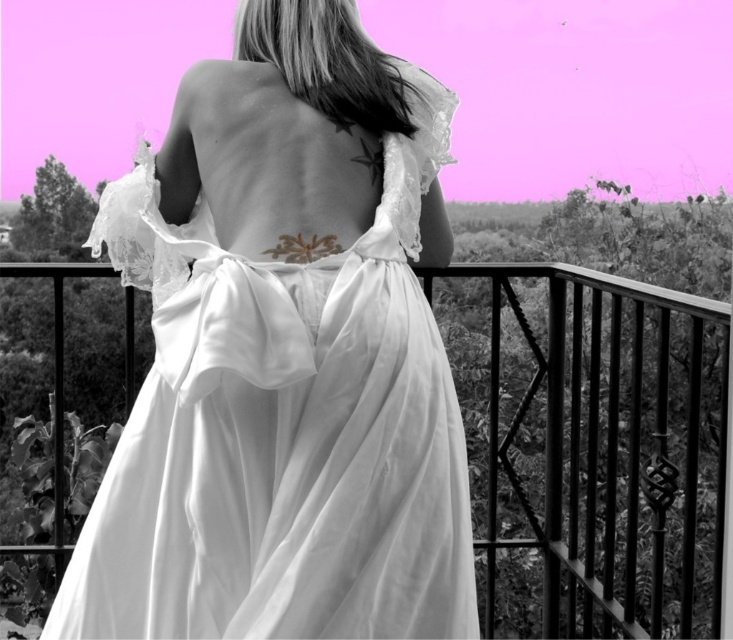
You are a GUI agent. You are given a task and a screenshot of the screen. Output one action in this format:
    pyautogui.click(x=<x>, y=<y>)
    Task: Click on the satin dress at center
    Image resolution: width=733 pixels, height=640 pixels.
    Given the screenshot: What is the action you would take?
    pyautogui.click(x=283, y=358)

Is satin dress at center bigger than metallic black balcony at center?

Actually, satin dress at center might be smaller than metallic black balcony at center.

Which is behind, point (81, 612) or point (594, 515)?

Point (594, 515)

Find the location of `satin dress at center`. satin dress at center is located at coordinates (283, 358).